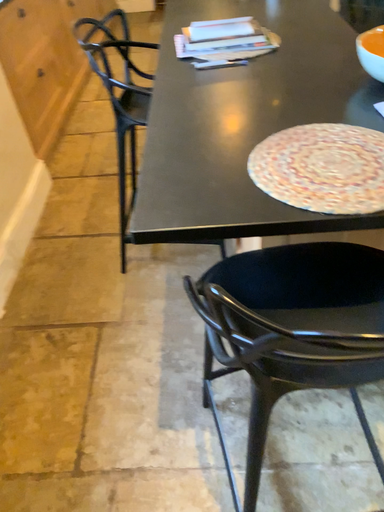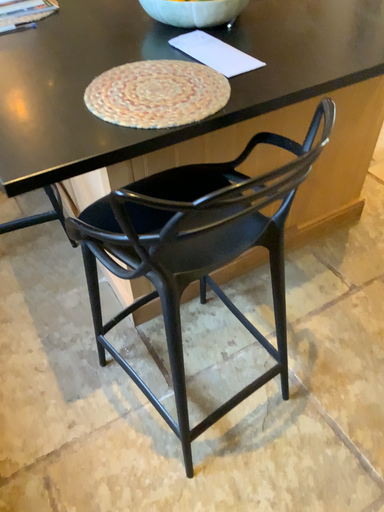
Question: How did the camera likely rotate when shooting the video?

Choices:
 (A) rotated left
 (B) rotated right

Answer: (B)